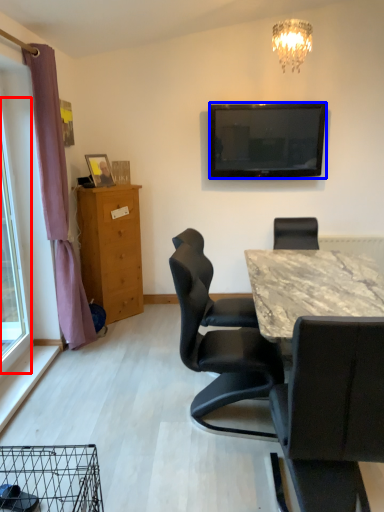
Question: Among these objects, which one is farthest to the camera, glass door (highlighted by a red box) or television (highlighted by a blue box)?

Choices:
 (A) glass door
 (B) television

Answer: (B)